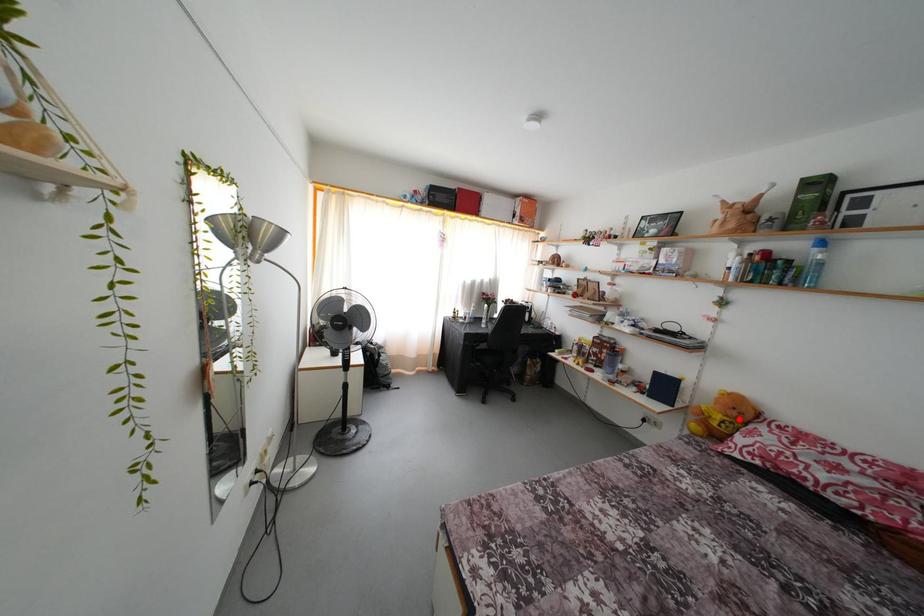
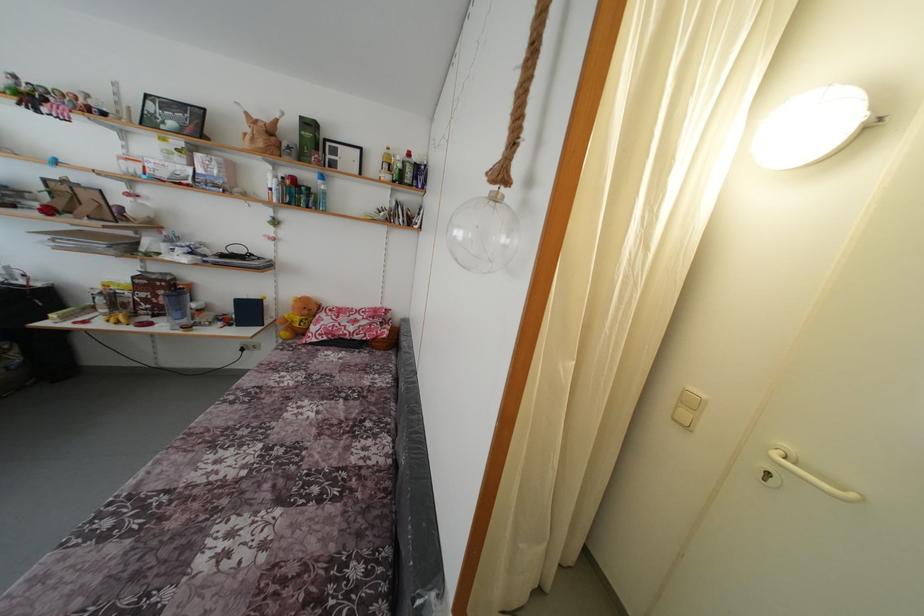
Find the pixel in the second image that matches the highlighted location in the first image.

(310, 317)